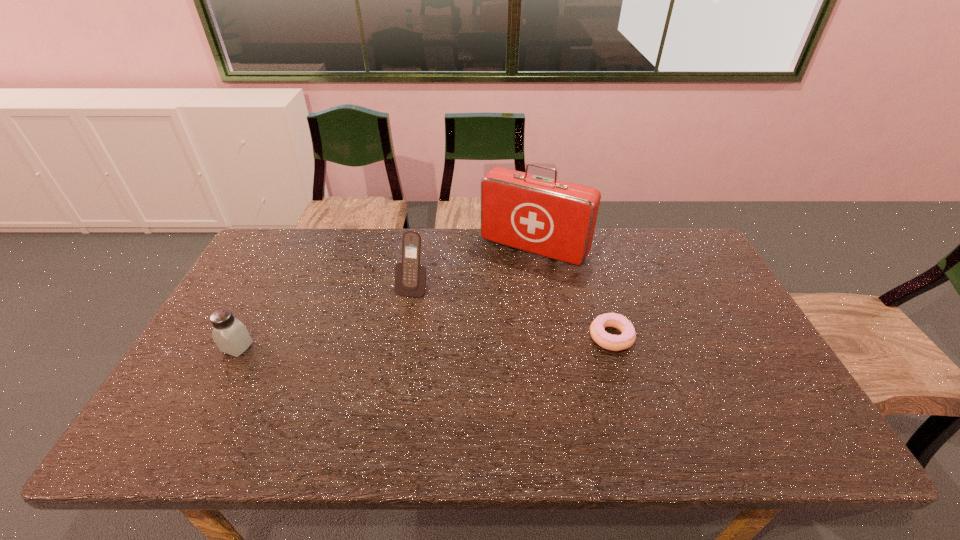
This screenshot has width=960, height=540. What are the coordinates of `free space on the desktop that is between the saltshaker and the doughnut and is positioned on the front-facing side of the third object from right to left` in the screenshot? It's located at (390, 343).

The height and width of the screenshot is (540, 960). In order to click on vacant space on the desktop that is between the saltshaker and the doughnut and is positioned on the side of the tallest object with the first aid cross symbol in this screenshot , I will do `click(474, 340)`.